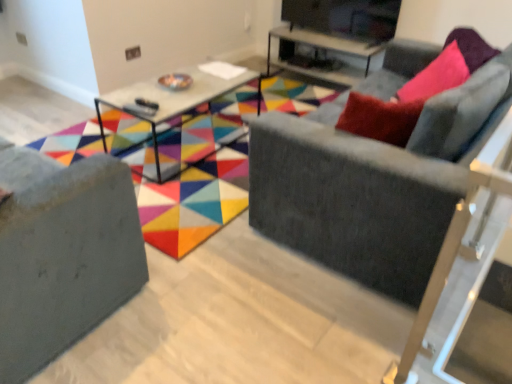
Locate an element on the screen. free spot below matte black tv stand at upper center (from a real-world perspective) is located at coordinates click(344, 38).